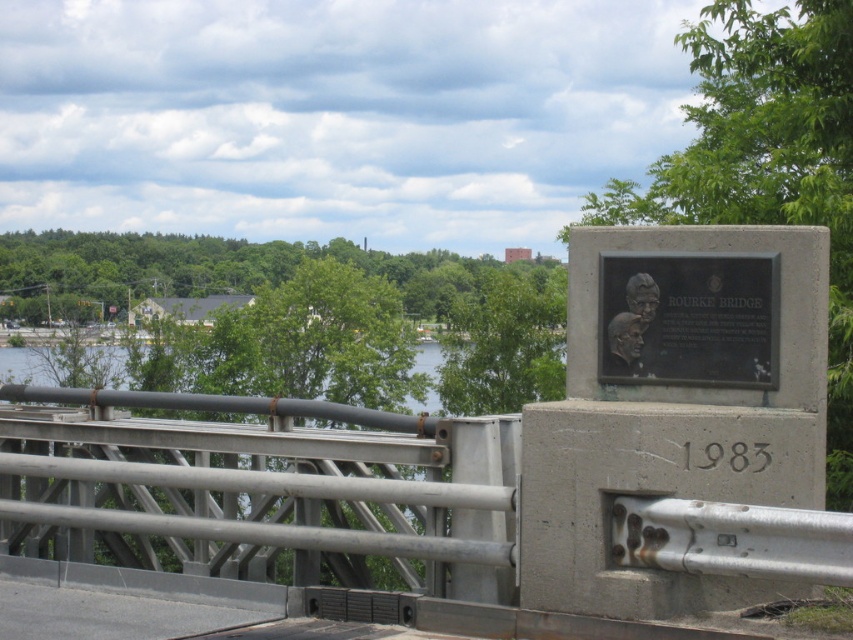
Is the position of gray metallic bridge at center less distant than that of black polished metal plaque at center?

Yes, it is in front of black polished metal plaque at center.

The image size is (853, 640). Describe the element at coordinates (283, 504) in the screenshot. I see `gray metallic bridge at center` at that location.

Where is `gray metallic bridge at center`? This screenshot has height=640, width=853. gray metallic bridge at center is located at coordinates (283, 504).

Can you confirm if gray concrete plaque at right is wider than black polished metal plaque at center?

Correct, the width of gray concrete plaque at right exceeds that of black polished metal plaque at center.

Where is `gray concrete plaque at right`? This screenshot has width=853, height=640. gray concrete plaque at right is located at coordinates (674, 404).

Who is positioned more to the left, gray metallic bridge at center or gray concrete plaque at right?

Positioned to the left is gray metallic bridge at center.

Is point (93, 396) in front of point (598, 579)?

No.

This screenshot has width=853, height=640. Find the location of `gray metallic bridge at center`. gray metallic bridge at center is located at coordinates click(x=283, y=504).